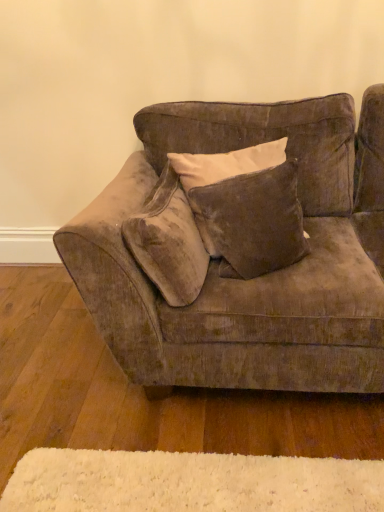
This screenshot has width=384, height=512. What are the coordinates of `free space above white fluffy mat at lower center (from a real-world perspective)` in the screenshot? It's located at (180, 479).